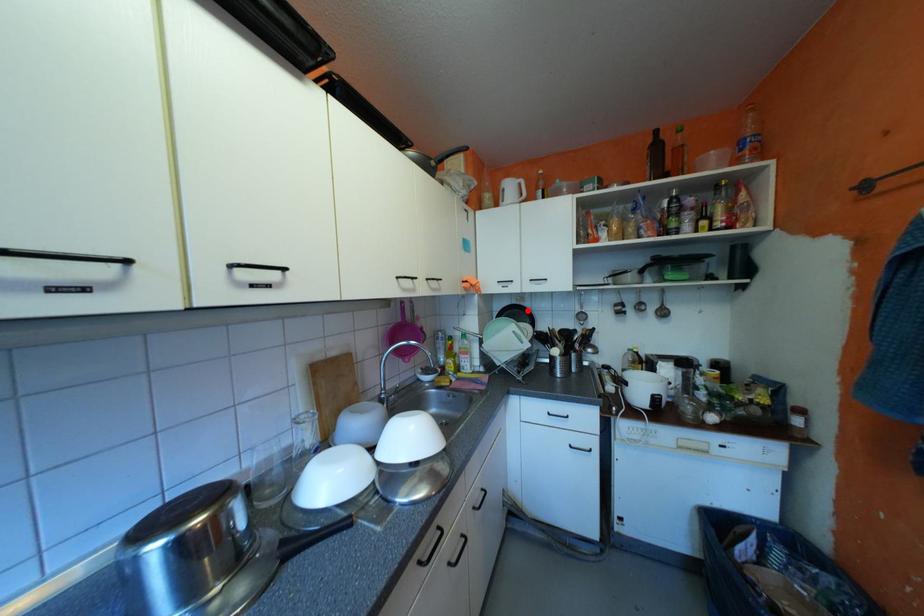
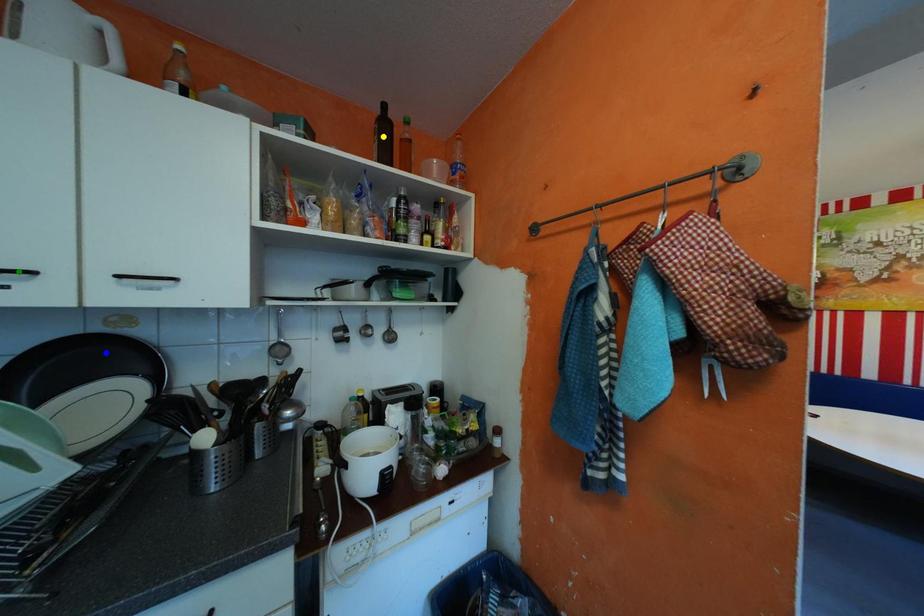
Question: I am providing you with two images of the same scene from different viewpoints. A red point is marked on the first image. You are given multiple points on the second image. Which spot in image 2 lines up with the point in image 1?

Choices:
 (A) yellow point
 (B) green point
 (C) blue point

Answer: (C)